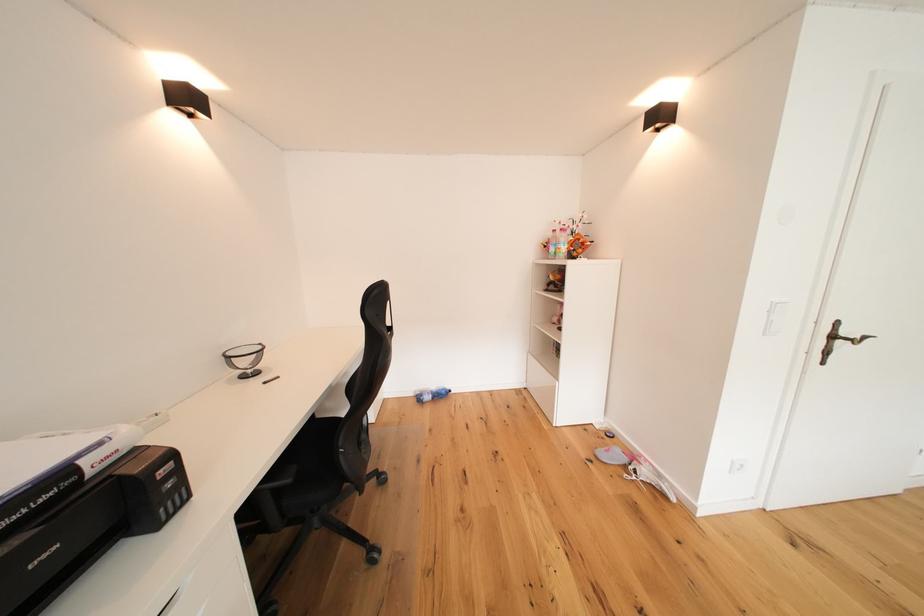
Where would you pull the silver drawer handle? Please return your answer as a coordinate pair (x, y).

(168, 602)